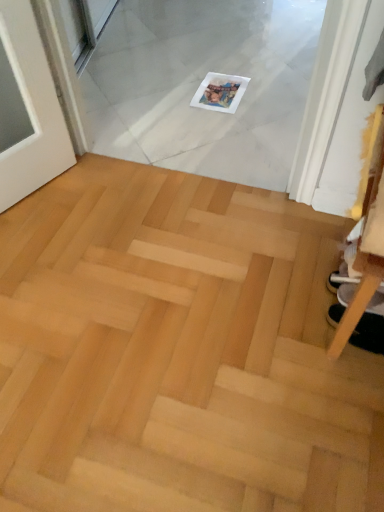
Question: Does white fabric shoe at lower right have a lesser width compared to natural wood parquet floor at center?

Choices:
 (A) yes
 (B) no

Answer: (A)

Question: From a real-world perspective, is white fabric shoe at lower right located beneath natural wood parquet floor at center?

Choices:
 (A) yes
 (B) no

Answer: (B)

Question: From a real-world perspective, is white fabric shoe at lower right on top of natural wood parquet floor at center?

Choices:
 (A) yes
 (B) no

Answer: (A)

Question: Can you confirm if white fabric shoe at lower right is positioned to the left of natural wood parquet floor at center?

Choices:
 (A) yes
 (B) no

Answer: (B)

Question: Is white fabric shoe at lower right behind natural wood parquet floor at center?

Choices:
 (A) yes
 (B) no

Answer: (A)

Question: Can you confirm if white fabric shoe at lower right is wider than natural wood parquet floor at center?

Choices:
 (A) yes
 (B) no

Answer: (B)

Question: From the image's perspective, is natural wood parquet floor at center under white fabric shoe at lower right?

Choices:
 (A) yes
 (B) no

Answer: (A)

Question: Does natural wood parquet floor at center contain white fabric shoe at lower right?

Choices:
 (A) yes
 (B) no

Answer: (B)

Question: Is natural wood parquet floor at center placed right next to white fabric shoe at lower right?

Choices:
 (A) no
 (B) yes

Answer: (A)

Question: Would you consider natural wood parquet floor at center to be distant from white fabric shoe at lower right?

Choices:
 (A) yes
 (B) no

Answer: (B)

Question: Is natural wood parquet floor at center positioned with its back to white fabric shoe at lower right?

Choices:
 (A) yes
 (B) no

Answer: (B)

Question: Does natural wood parquet floor at center have a greater height compared to white fabric shoe at lower right?

Choices:
 (A) no
 (B) yes

Answer: (A)

Question: In terms of height, does natural wood parquet floor at center look taller or shorter compared to white fabric shoe at lower right?

Choices:
 (A) tall
 (B) short

Answer: (B)